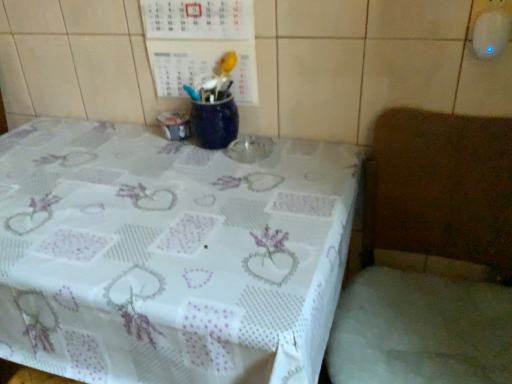
Question: Is white lace tablecloth at lower right wider than white lace tablecloth at center?

Choices:
 (A) yes
 (B) no

Answer: (B)

Question: Is white lace tablecloth at center surrounded by white lace tablecloth at lower right?

Choices:
 (A) yes
 (B) no

Answer: (B)

Question: Does white lace tablecloth at lower right have a lesser height compared to white lace tablecloth at center?

Choices:
 (A) yes
 (B) no

Answer: (A)

Question: Can you confirm if white lace tablecloth at lower right is positioned to the right of white lace tablecloth at center?

Choices:
 (A) yes
 (B) no

Answer: (A)

Question: Does white lace tablecloth at lower right have a larger size compared to white lace tablecloth at center?

Choices:
 (A) no
 (B) yes

Answer: (A)

Question: Is wooden chair at right inside the boundaries of white lace tablecloth at lower right, or outside?

Choices:
 (A) inside
 (B) outside

Answer: (B)

Question: Considering the positions of wooden chair at right and white lace tablecloth at lower right in the image, is wooden chair at right bigger or smaller than white lace tablecloth at lower right?

Choices:
 (A) big
 (B) small

Answer: (A)

Question: In the image, is wooden chair at right positioned in front of or behind white lace tablecloth at lower right?

Choices:
 (A) front
 (B) behind

Answer: (A)

Question: Does point (357, 367) appear closer or farther from the camera than point (339, 372)?

Choices:
 (A) closer
 (B) farther

Answer: (B)

Question: From the image's perspective, is wooden chair at right located above or below white lace tablecloth at center?

Choices:
 (A) above
 (B) below

Answer: (B)

Question: From a real-world perspective, is wooden chair at right above or below white lace tablecloth at center?

Choices:
 (A) below
 (B) above

Answer: (B)

Question: In terms of width, does wooden chair at right look wider or thinner when compared to white lace tablecloth at center?

Choices:
 (A) wide
 (B) thin

Answer: (B)

Question: Which is correct: wooden chair at right is inside white lace tablecloth at center, or outside of it?

Choices:
 (A) inside
 (B) outside

Answer: (B)

Question: In the image, is white lace tablecloth at lower right on the left side or the right side of wooden chair at right?

Choices:
 (A) left
 (B) right

Answer: (A)

Question: From the image's perspective, is white lace tablecloth at lower right positioned above or below wooden chair at right?

Choices:
 (A) above
 (B) below

Answer: (A)